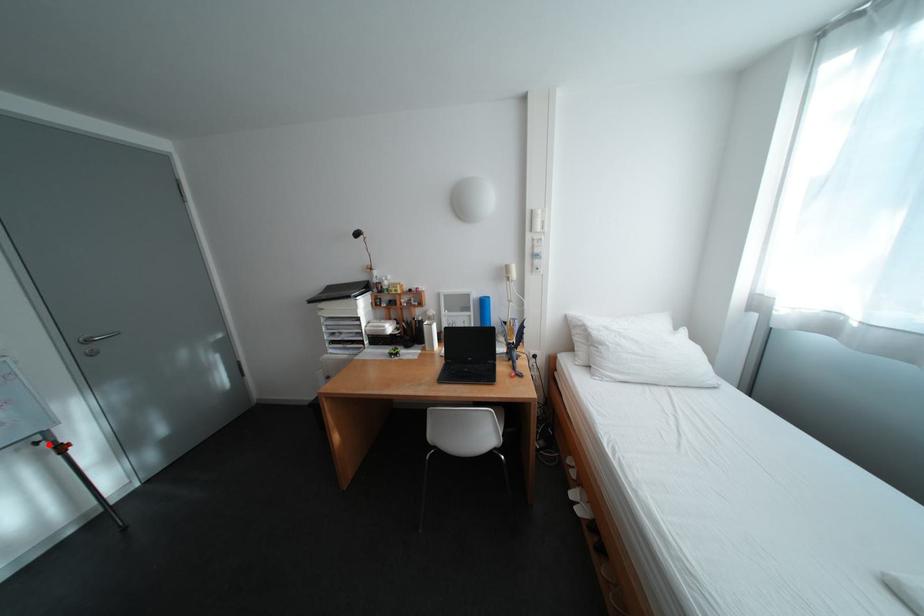
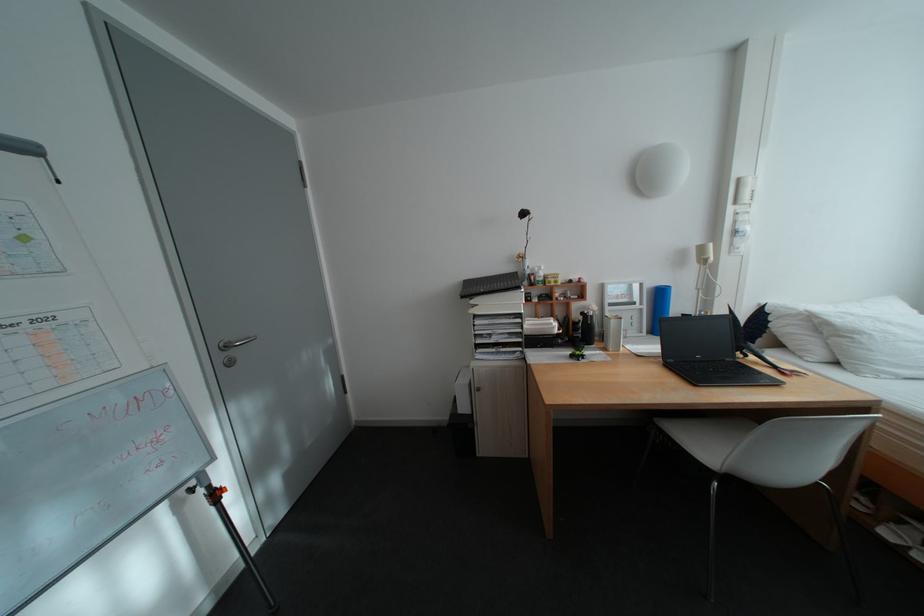
Question: I am providing you with two images of the same scene from different viewpoints. In image1, a red point is highlighted. Considering the same 3D point in image2, which of the following is correct?

Choices:
 (A) It is closer
 (B) It is farther

Answer: (A)